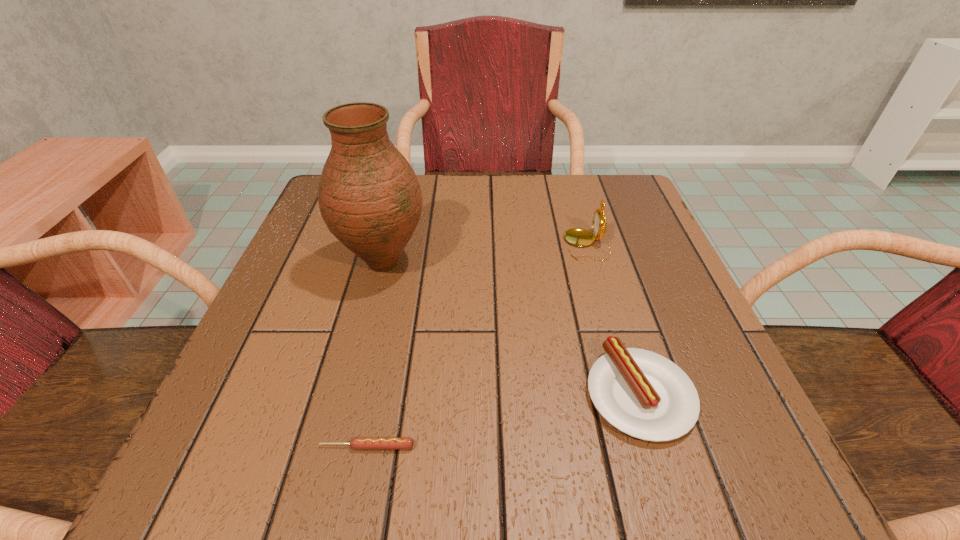
I want to click on free point between the tallest object and the shortest object, so click(375, 355).

Where is `free space that is in between the shortest object and the taller sausage`? The image size is (960, 540). free space that is in between the shortest object and the taller sausage is located at coordinates point(503,420).

The width and height of the screenshot is (960, 540). I want to click on free space between the vase and the left sausage, so click(x=375, y=355).

Choose which object is the second nearest neighbor to the shorter sausage. Please provide its 2D coordinates. Your answer should be formatted as a tuple, i.e. [(x, y)], where the tuple contains the x and y coordinates of a point satisfying the conditions above.

[(369, 197)]

I want to click on object that can be found as the third closest to the vase, so click(641, 393).

I want to click on vacant space that satisfies the following two spatial constraints: 1. on the face of the right sausage; 2. on the left side of the second tallest object, so click(x=629, y=394).

The width and height of the screenshot is (960, 540). What are the coordinates of `blank space that satisfies the following two spatial constraints: 1. on the back side of the left sausage; 2. on the left side of the taller sausage` in the screenshot? It's located at (377, 394).

Find the location of `free space that satisfies the following two spatial constraints: 1. on the back side of the taller sausage; 2. on the face of the second tallest object`. free space that satisfies the following two spatial constraints: 1. on the back side of the taller sausage; 2. on the face of the second tallest object is located at coordinates (593, 245).

The height and width of the screenshot is (540, 960). Find the location of `free space that satisfies the following two spatial constraints: 1. on the back side of the third tallest object; 2. on the face of the pocket watch`. free space that satisfies the following two spatial constraints: 1. on the back side of the third tallest object; 2. on the face of the pocket watch is located at coordinates (593, 245).

Where is `vacant space that satisfies the following two spatial constraints: 1. on the back side of the right sausage; 2. on the face of the pocket watch`? This screenshot has width=960, height=540. vacant space that satisfies the following two spatial constraints: 1. on the back side of the right sausage; 2. on the face of the pocket watch is located at coordinates (593, 245).